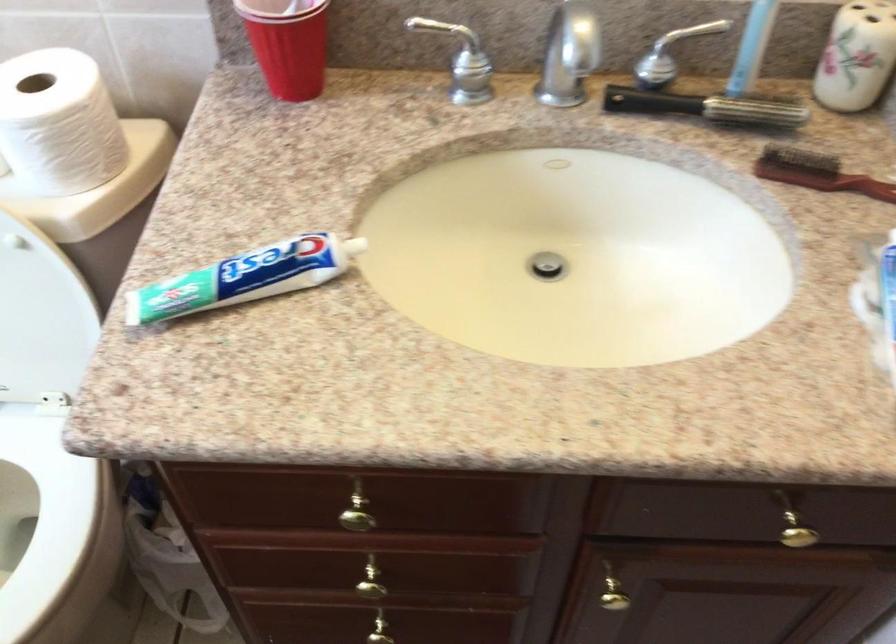
The image size is (896, 644). What are the coordinates of `black handle brush` in the screenshot? It's located at (707, 107).